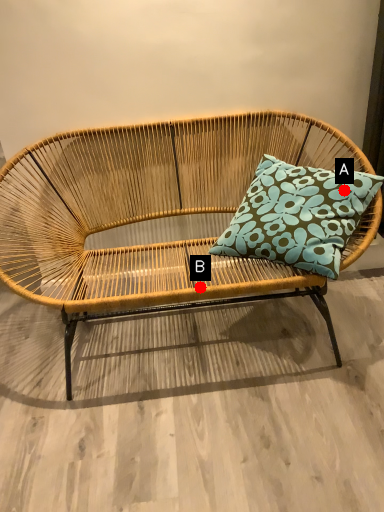
Question: Two points are circled on the image, labeled by A and B beside each circle. Which of the following is the farthest from the observer?

Choices:
 (A) A is further
 (B) B is further

Answer: (A)